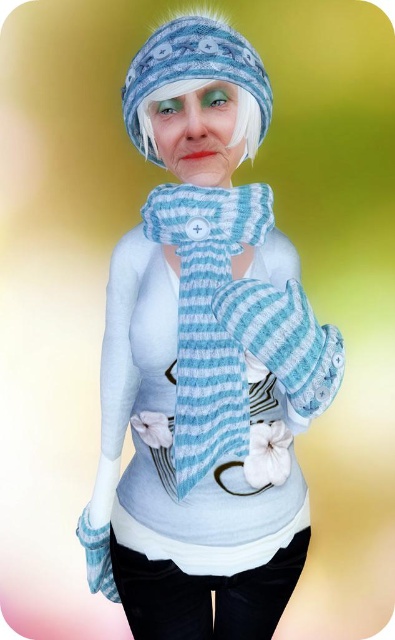
Question: Does knitted blue-white striped scarf at center lie in front of white fuzzy hat at upper center?

Choices:
 (A) no
 (B) yes

Answer: (A)

Question: Which of these objects is positioned closest to the knitted wool scarf at center?

Choices:
 (A) knitted blue-white striped scarf at center
 (B) white fuzzy hat at upper center
 (C) fuzzy woolen hat at upper center

Answer: (A)

Question: Which point is farther to the camera?

Choices:
 (A) knitted blue-white striped scarf at center
 (B) white fuzzy hat at upper center

Answer: (A)

Question: Does knitted wool scarf at center appear under knitted blue-white striped scarf at center?

Choices:
 (A) no
 (B) yes

Answer: (B)

Question: Based on their relative distances, which object is farther from the knitted blue-white striped scarf at center?

Choices:
 (A) white fuzzy hat at upper center
 (B) fuzzy woolen hat at upper center
 (C) knitted wool scarf at center

Answer: (A)

Question: Does knitted wool scarf at center lie behind knitted blue-white striped scarf at center?

Choices:
 (A) no
 (B) yes

Answer: (A)